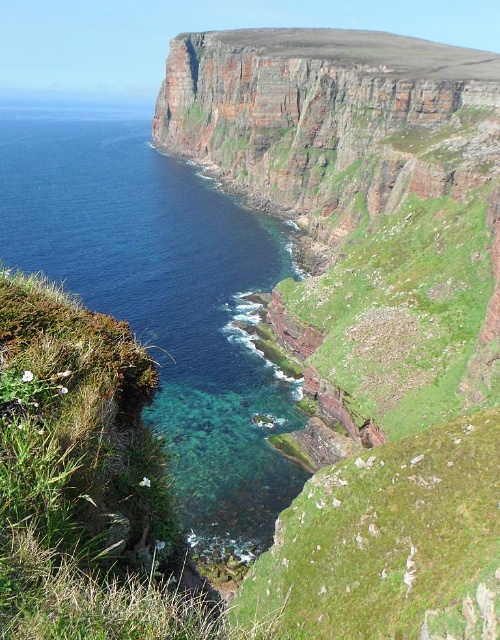
Can you confirm if green grassy hillside at upper center is positioned below clear blue water at lower left?

Actually, green grassy hillside at upper center is above clear blue water at lower left.

Does point (384, 209) lie behind point (122, 278)?

No, it is not.

Measure the distance between green grassy hillside at upper center and camera.

87.80 feet

Where is `green grassy hillside at upper center`? green grassy hillside at upper center is located at coordinates (370, 314).